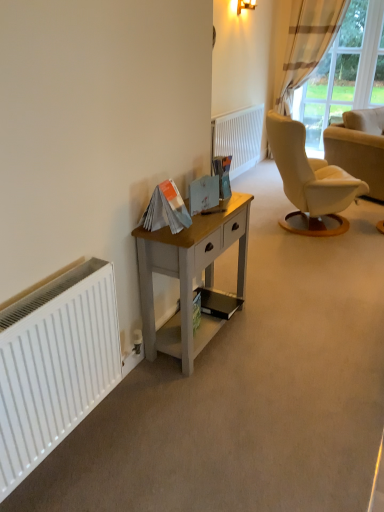
Question: From the image's perspective, would you say light gray wood desk at center is positioned over plaid fabric curtain at upper right?

Choices:
 (A) no
 (B) yes

Answer: (A)

Question: Are light gray wood desk at center and plaid fabric curtain at upper right located far from each other?

Choices:
 (A) yes
 (B) no

Answer: (A)

Question: Can you confirm if light gray wood desk at center is positioned to the right of plaid fabric curtain at upper right?

Choices:
 (A) yes
 (B) no

Answer: (B)

Question: Is light gray wood desk at center with plaid fabric curtain at upper right?

Choices:
 (A) no
 (B) yes

Answer: (A)

Question: Could you tell me if light gray wood desk at center is facing plaid fabric curtain at upper right?

Choices:
 (A) yes
 (B) no

Answer: (B)

Question: From a real-world perspective, is light gray wood desk at center under plaid fabric curtain at upper right?

Choices:
 (A) yes
 (B) no

Answer: (A)

Question: Does white matte radiator at left, the 2th radiator in the top-to-bottom sequence, come in front of brown striped fabric curtain at upper right?

Choices:
 (A) yes
 (B) no

Answer: (A)

Question: Is white matte radiator at left, the 2th radiator viewed from the back, not near brown striped fabric curtain at upper right?

Choices:
 (A) yes
 (B) no

Answer: (A)

Question: Considering the relative positions of white matte radiator at left, which is the first radiator from front to back, and brown striped fabric curtain at upper right in the image provided, is white matte radiator at left, which is the first radiator from front to back, to the left of brown striped fabric curtain at upper right from the viewer's perspective?

Choices:
 (A) no
 (B) yes

Answer: (B)

Question: Does white matte radiator at left, the 2th radiator in the top-to-bottom sequence, come behind brown striped fabric curtain at upper right?

Choices:
 (A) no
 (B) yes

Answer: (A)

Question: From the image's perspective, is white matte radiator at left, which is the first radiator from front to back, under brown striped fabric curtain at upper right?

Choices:
 (A) yes
 (B) no

Answer: (A)

Question: Would you say brown striped fabric curtain at upper right is part of white matte radiator at left, acting as the 2th radiator starting from the right,'s contents?

Choices:
 (A) yes
 (B) no

Answer: (B)

Question: Is there a large distance between matte gold wall sconce at upper center and white textured radiator at center, positioned as the 2th radiator in front-to-back order?

Choices:
 (A) yes
 (B) no

Answer: (A)